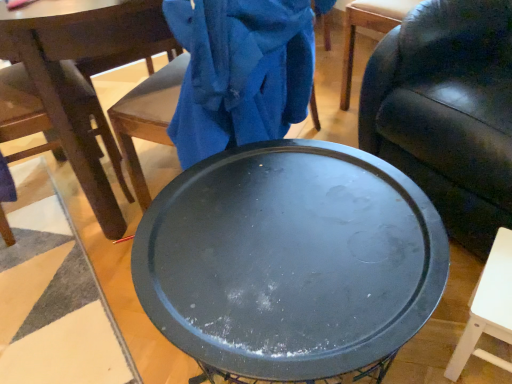
Question: From a real-world perspective, is black matte round table at center below leather couch at center, the 2th chair when ordered from left to right?

Choices:
 (A) no
 (B) yes

Answer: (B)

Question: Is black matte round table at center taller than leather couch at center, the 1th chair when ordered from right to left?

Choices:
 (A) no
 (B) yes

Answer: (A)

Question: Is black matte round table at center wider than leather couch at center, the 1th chair when ordered from right to left?

Choices:
 (A) no
 (B) yes

Answer: (A)

Question: From the image's perspective, is black matte round table at center on top of leather couch at center, the 2th chair when ordered from left to right?

Choices:
 (A) no
 (B) yes

Answer: (A)

Question: Is black matte round table at center not within leather couch at center, the 2th chair when ordered from left to right?

Choices:
 (A) yes
 (B) no

Answer: (A)

Question: Can you see black matte round table at center touching leather couch at center, the 2th chair when ordered from left to right?

Choices:
 (A) yes
 (B) no

Answer: (B)

Question: Is dark brown wood chair at left, the 1th chair from the left, completely or partially outside of leather couch at center, the 2th chair when ordered from left to right?

Choices:
 (A) no
 (B) yes

Answer: (B)

Question: Considering the relative sizes of dark brown wood chair at left, the 1th chair from the left, and leather couch at center, the 2th chair when ordered from left to right, in the image provided, is dark brown wood chair at left, the 1th chair from the left, thinner than leather couch at center, the 2th chair when ordered from left to right,?

Choices:
 (A) yes
 (B) no

Answer: (A)

Question: From a real-world perspective, is dark brown wood chair at left, the 1th chair from the left, located higher than leather couch at center, the 1th chair when ordered from right to left?

Choices:
 (A) yes
 (B) no

Answer: (A)

Question: From a real-world perspective, is dark brown wood chair at left, which is the second chair from right to left, below leather couch at center, the 2th chair when ordered from left to right?

Choices:
 (A) yes
 (B) no

Answer: (B)

Question: From the image's perspective, is dark brown wood chair at left, which is the second chair from right to left, located above leather couch at center, the 2th chair when ordered from left to right?

Choices:
 (A) yes
 (B) no

Answer: (B)

Question: Is dark brown wood chair at left, which is the second chair from right to left, further to camera compared to leather couch at center, the 2th chair when ordered from left to right?

Choices:
 (A) no
 (B) yes

Answer: (B)

Question: Can you confirm if black matte round table at center is positioned to the left of dark brown wood chair at left, the 1th chair from the left?

Choices:
 (A) yes
 (B) no

Answer: (B)